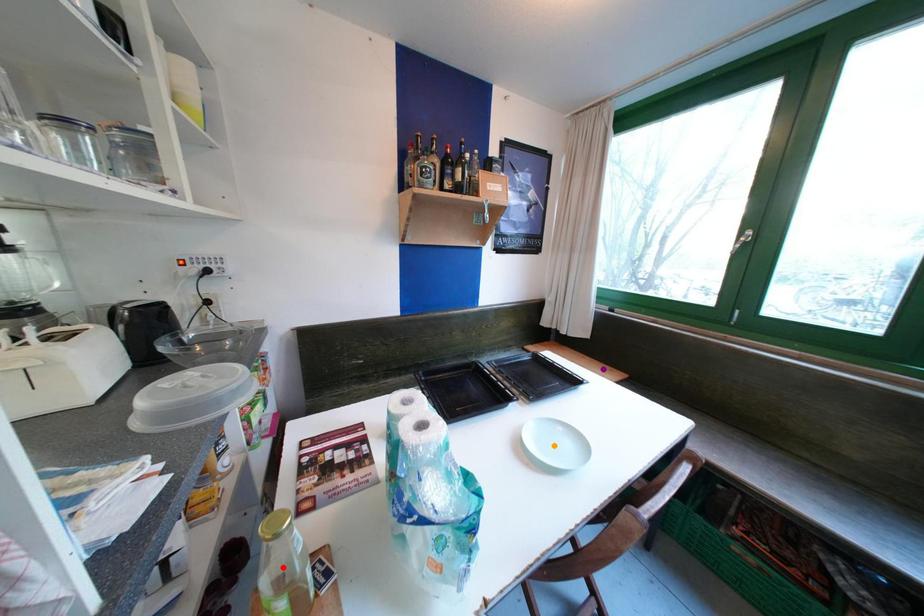
From the picture: Order these from nearest to farthest:
A) red point
B) purple point
C) orange point

1. red point
2. orange point
3. purple point